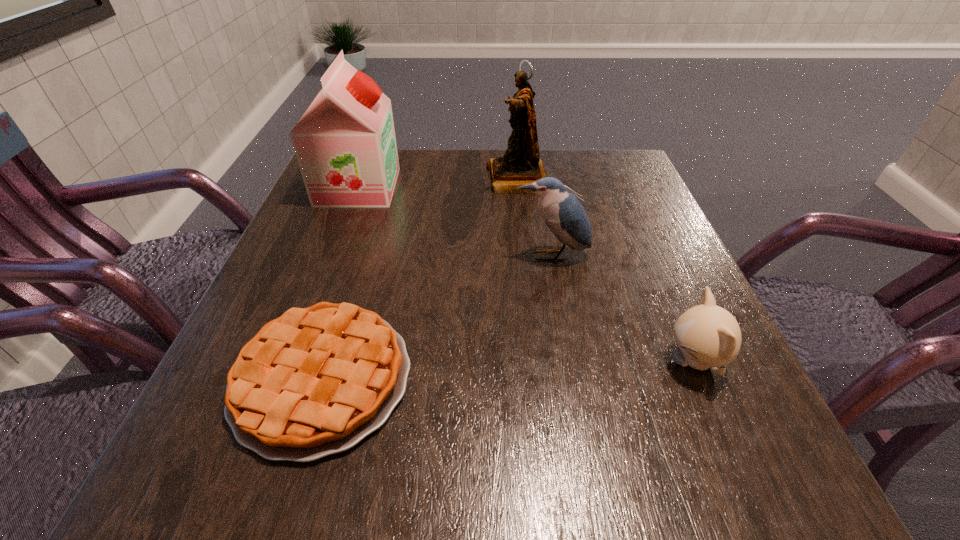
Where is `soya milk`? This screenshot has width=960, height=540. soya milk is located at coordinates (345, 144).

I want to click on figurine, so click(x=521, y=165).

Find the location of a particular element. Image resolution: width=960 pixels, height=540 pixels. the third tallest object is located at coordinates (562, 212).

The width and height of the screenshot is (960, 540). I want to click on the third nearest object, so click(x=562, y=212).

Locate an element on the screen. This screenshot has height=540, width=960. kitten is located at coordinates (708, 336).

This screenshot has height=540, width=960. Find the location of `the second shortest object`. the second shortest object is located at coordinates (708, 336).

Locate an element on the screen. The width and height of the screenshot is (960, 540). pie is located at coordinates (316, 381).

Identify the location of free spot located with the cap open on the soya milk. 429,187.

Identify the location of vacant space located 0.080m on the front-facing side of the figurine. This screenshot has width=960, height=540. (453, 180).

Find the location of a particular element. Image resolution: width=960 pixels, height=540 pixels. vacant space located 0.100m on the front-facing side of the figurine is located at coordinates (445, 180).